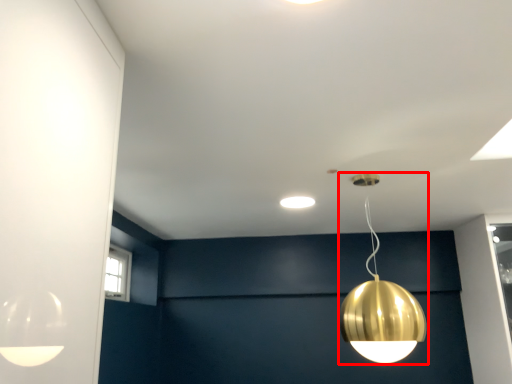
Question: From the image's perspective, considering the relative positions of lamp (annotated by the red box) and lamp in the image provided, where is lamp (annotated by the red box) located with respect to the staircase?

Choices:
 (A) above
 (B) below

Answer: (B)